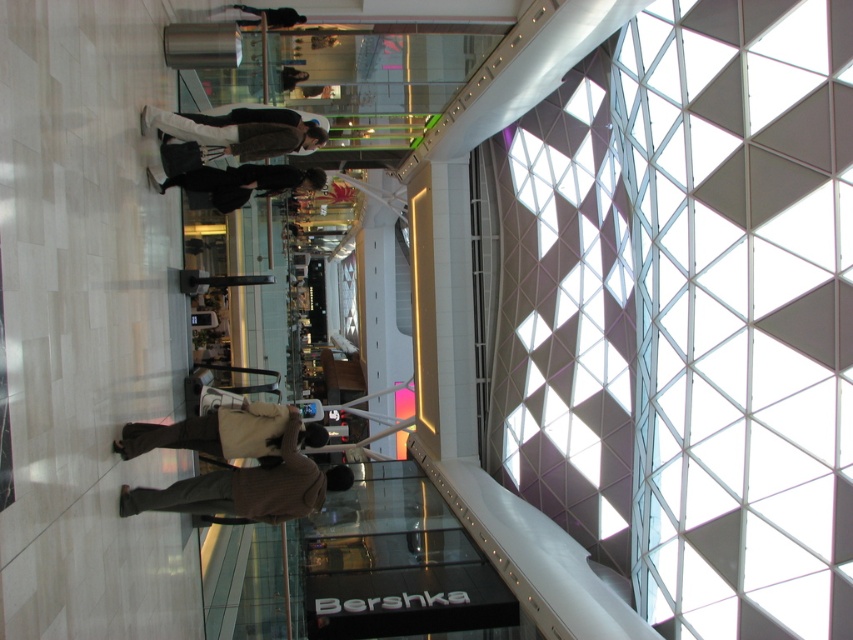
Is brown wool sweater at center thinner than dark brown leather jacket at center?

Incorrect, brown wool sweater at center's width is not less than dark brown leather jacket at center's.

Is point (281, 499) positioned behind point (277, 170)?

No, (281, 499) is in front of (277, 170).

Which is behind, point (247, 476) or point (201, 177)?

Point (201, 177)

Locate an element on the screen. The height and width of the screenshot is (640, 853). brown wool sweater at center is located at coordinates (248, 486).

Between brown wool sweater at center and brown wool coat at center, which one appears on the left side from the viewer's perspective?

Positioned to the left is brown wool sweater at center.

Identify the location of brown wool sweater at center. (248, 486).

Image resolution: width=853 pixels, height=640 pixels. What are the coordinates of `brown wool sweater at center` in the screenshot? It's located at (248, 486).

This screenshot has width=853, height=640. What do you see at coordinates (212, 433) in the screenshot? I see `brown wool coat at center` at bounding box center [212, 433].

Which is below, brown wool coat at center or dark brown leather jacket at center?

Positioned lower is brown wool coat at center.

Is point (238, 417) in front of point (219, 204)?

Yes, point (238, 417) is in front of point (219, 204).

The height and width of the screenshot is (640, 853). I want to click on brown wool coat at center, so click(212, 433).